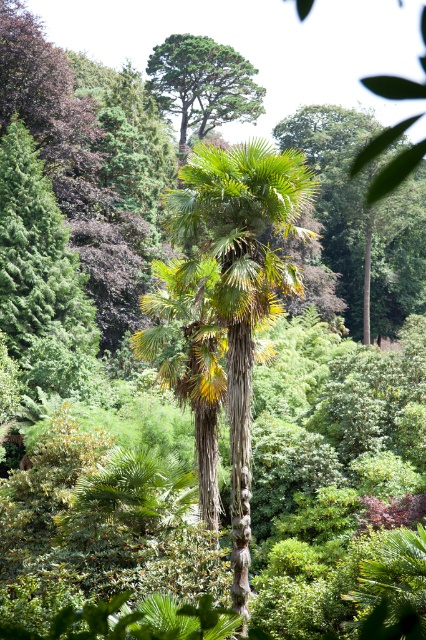
Can you confirm if green leafy palm tree at center is bigger than green leafy palm at center?

Actually, green leafy palm tree at center might be smaller than green leafy palm at center.

Can you confirm if green leafy palm tree at center is shorter than green leafy palm at center?

Yes.

Find the location of `green leafy palm tree at center`. green leafy palm tree at center is located at coordinates (241, 280).

Is green leafy palm tree at center wider than green leafy tree at upper center?

No, green leafy palm tree at center is not wider than green leafy tree at upper center.

Does green leafy palm tree at center have a lesser width compared to green leafy tree at upper center?

Correct, green leafy palm tree at center's width is less than green leafy tree at upper center's.

The width and height of the screenshot is (426, 640). I want to click on green leafy palm tree at center, so click(x=241, y=280).

Which is in front, point (371, 164) or point (152, 56)?

Positioned in front is point (371, 164).

Can you confirm if green leafy palm at center is wider than green leafy tree at upper center?

Correct, the width of green leafy palm at center exceeds that of green leafy tree at upper center.

Who is more distant from viewer, (x=409, y=212) or (x=164, y=68)?

Positioned behind is point (x=164, y=68).

Where is `green leafy palm at center`? This screenshot has width=426, height=640. green leafy palm at center is located at coordinates (362, 216).